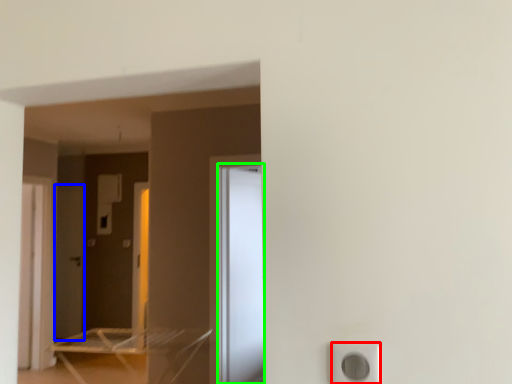
Question: Based on their relative distances, which object is nearer to electric outlet (highlighted by a red box)? Choose from screen door (highlighted by a blue box) and screen door (highlighted by a green box).

Choices:
 (A) screen door
 (B) screen door

Answer: (B)